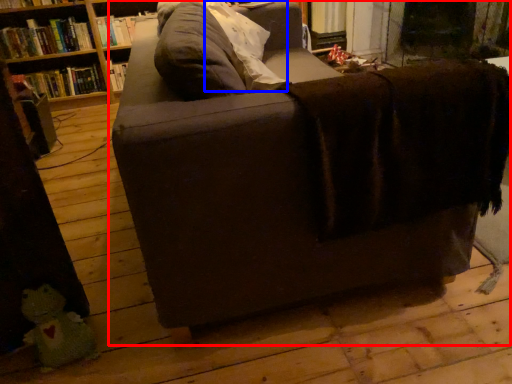
Question: Among these objects, which one is nearest to the camera, studio couch (highlighted by a red box) or pillow (highlighted by a blue box)?

Choices:
 (A) studio couch
 (B) pillow

Answer: (A)